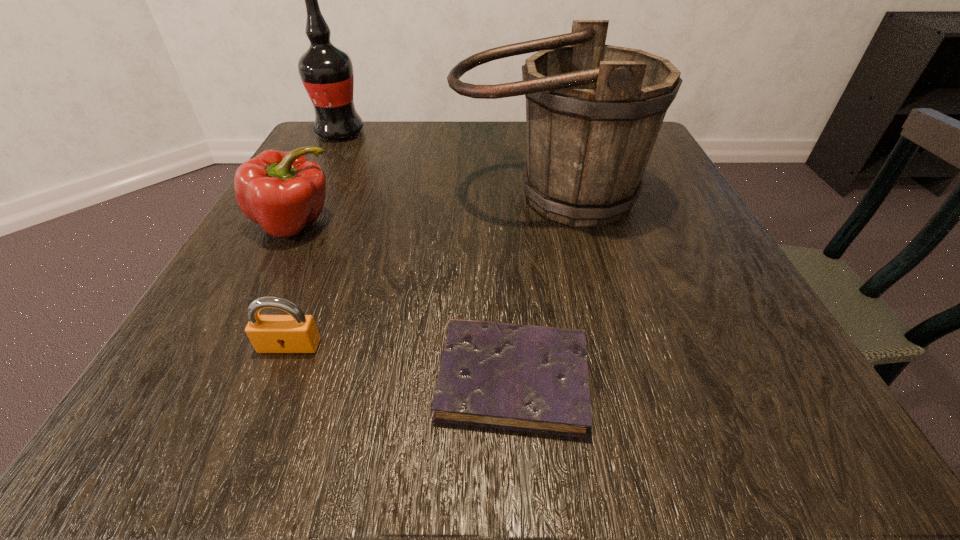
I want to click on bucket located at the far edge, so click(x=593, y=111).

Identify the location of object at the near edge. The height and width of the screenshot is (540, 960). (529, 378).

I want to click on wine bottle located at the left edge, so click(x=326, y=71).

At what (x,y) coordinates should I click in order to perform the action: click on pepper that is at the left edge. Please return your answer as a coordinate pair (x, y). This screenshot has height=540, width=960. Looking at the image, I should click on (282, 191).

Find the location of a particular element. The width and height of the screenshot is (960, 540). padlock located at the left edge is located at coordinates (296, 333).

Find the location of `object that is positioned at the right edge`. object that is positioned at the right edge is located at coordinates (593, 111).

Locate an element on the screen. This screenshot has height=540, width=960. object at the far left corner is located at coordinates (326, 71).

Find the location of a particular element. This screenshot has width=960, height=540. object present at the far right corner is located at coordinates (593, 111).

The width and height of the screenshot is (960, 540). What are the coordinates of `free space at the far edge of the desktop` in the screenshot? It's located at (501, 168).

Find the location of a particular element. free space at the near edge of the desktop is located at coordinates (608, 393).